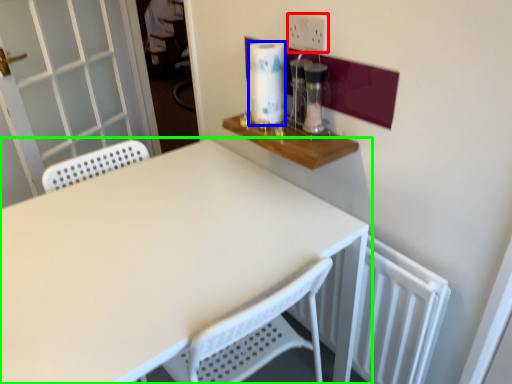
Question: Based on their relative distances, which object is farther from electric outlet (highlighted by a red box)? Choose from paper towel (highlighted by a blue box) and table (highlighted by a green box).

Choices:
 (A) paper towel
 (B) table

Answer: (B)